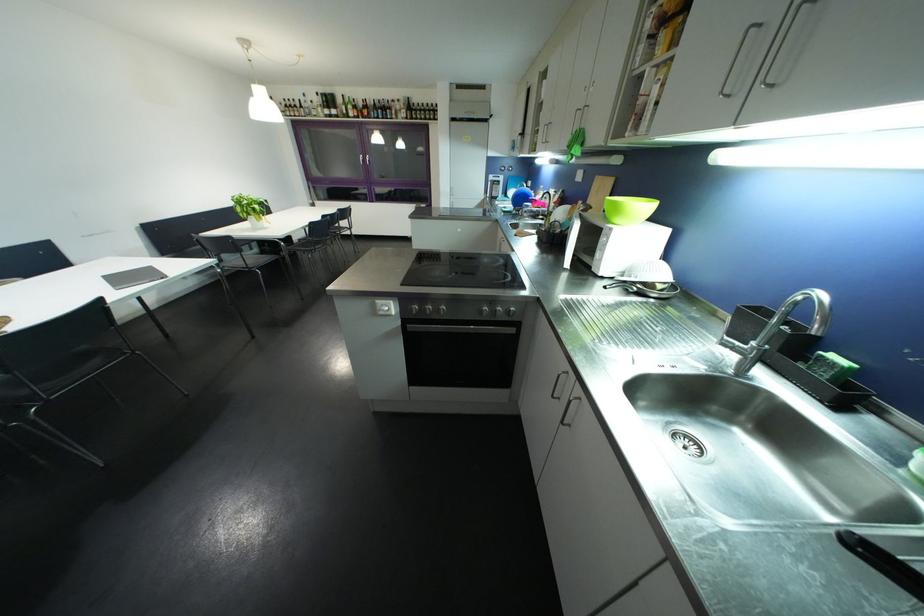
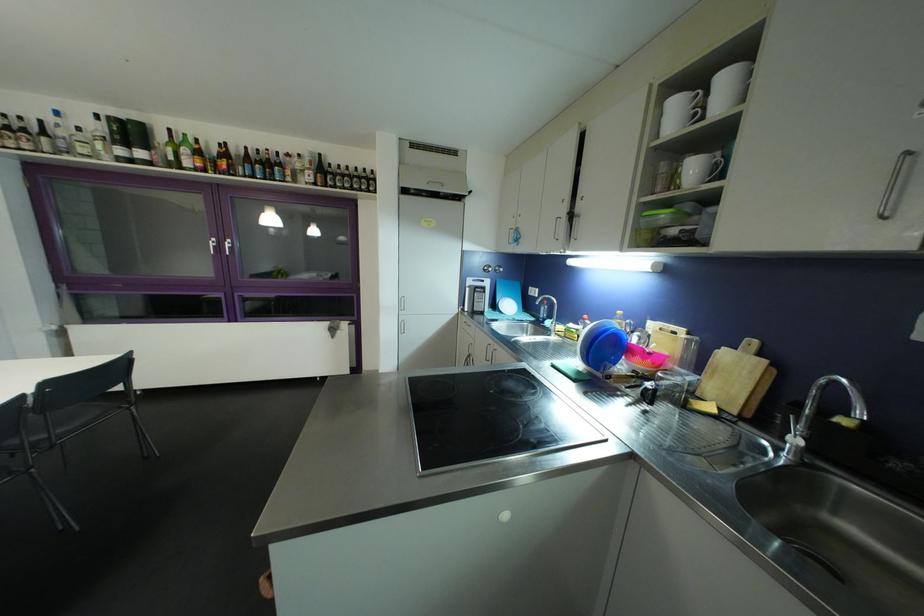
The point at (x=457, y=192) is marked in the first image. Where is the corresponding point in the second image?

(407, 302)